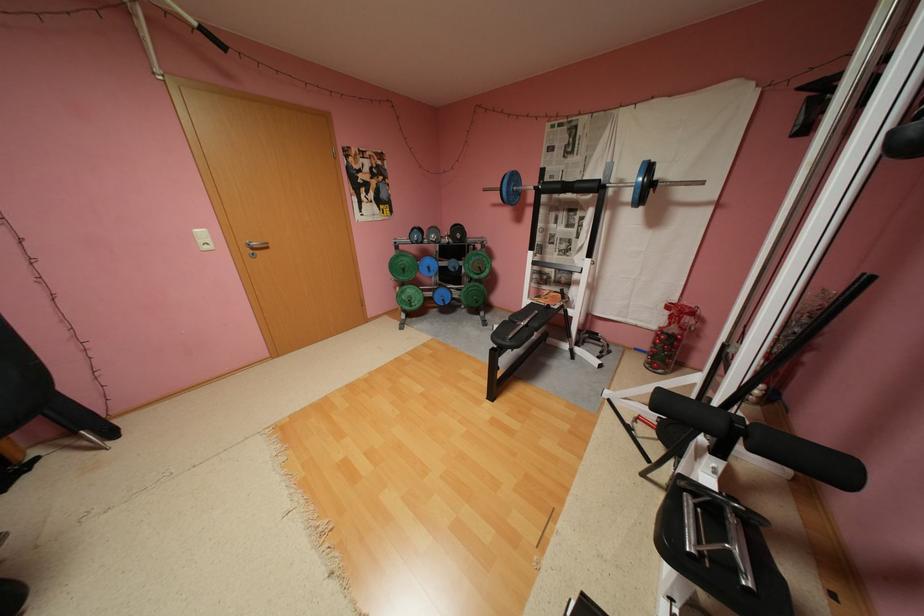
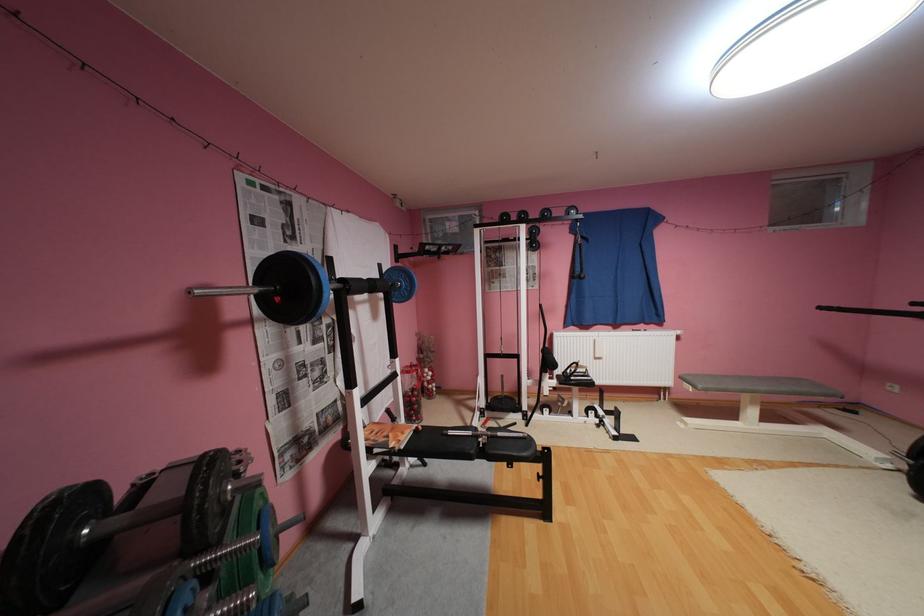
Question: I am providing you with two images of the same scene from different viewpoints. Which of the following objects are not visible in image2?

Choices:
 (A) black pull-up grip
 (B) white bench sitting surface
 (C) black pull-up bar
 (D) silver clothes hanger

Answer: (A)